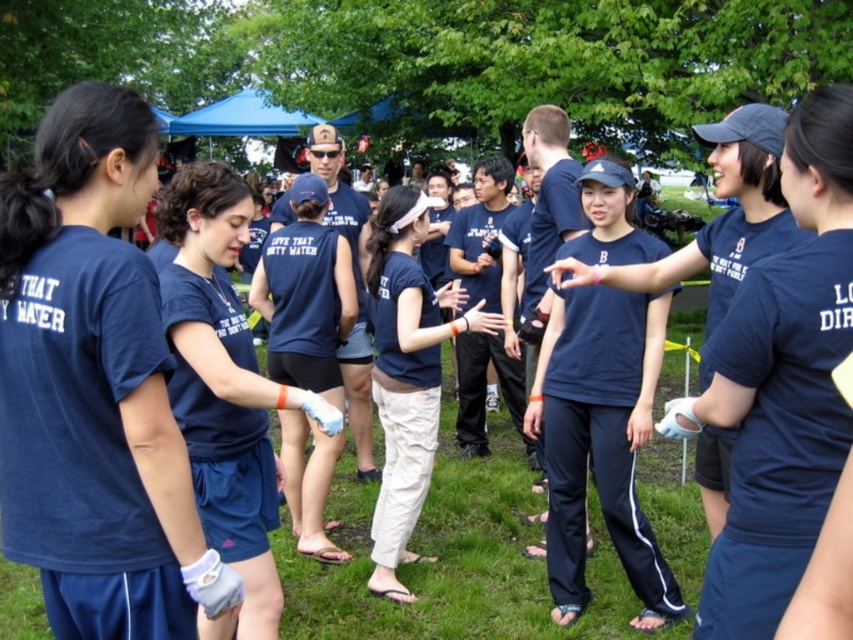
Question: Which point is farther from the camera taking this photo?

Choices:
 (A) (554, 429)
 (B) (221, 554)
 (C) (421, 403)
 (D) (36, 163)

Answer: (C)

Question: Can you confirm if navy blue jersey at left is positioned to the right of navy blue fabric shirt at center?

Choices:
 (A) yes
 (B) no

Answer: (B)

Question: Which point is farther to the camera?

Choices:
 (A) (641, 442)
 (B) (6, 456)

Answer: (A)

Question: Does navy blue fabric tank top at center appear under navy blue sleeveless shirt at center?

Choices:
 (A) no
 (B) yes

Answer: (B)

Question: Is navy blue track pants at center to the right of navy blue fabric tank top at center from the viewer's perspective?

Choices:
 (A) yes
 (B) no

Answer: (A)

Question: Among these points, which one is farthest from the camera?

Choices:
 (A) (395, 189)
 (B) (62, 104)
 (C) (227, 410)
 (D) (570, 397)

Answer: (A)